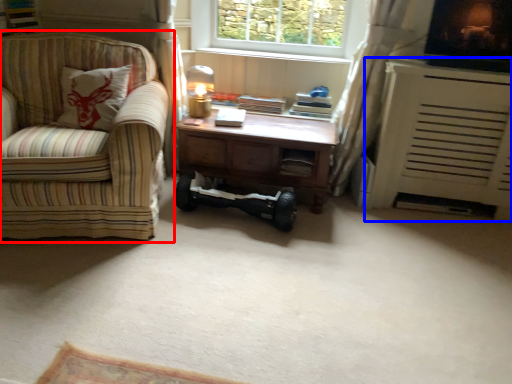
Question: Among these objects, which one is nearest to the camera, studio couch (highlighted by a red box) or heater (highlighted by a blue box)?

Choices:
 (A) studio couch
 (B) heater

Answer: (A)